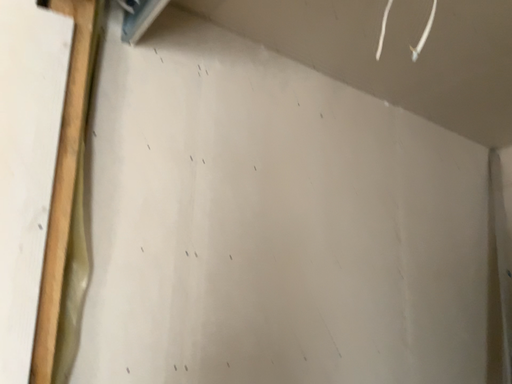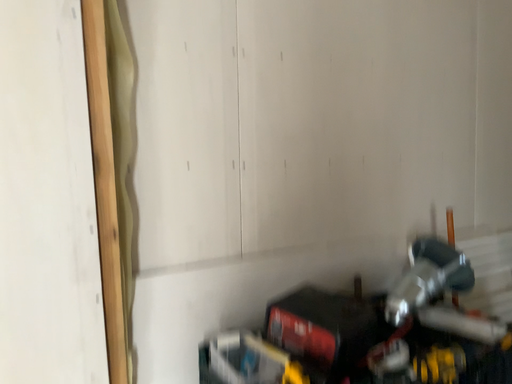
Question: How did the camera likely rotate when shooting the video?

Choices:
 (A) rotated left
 (B) rotated right

Answer: (A)